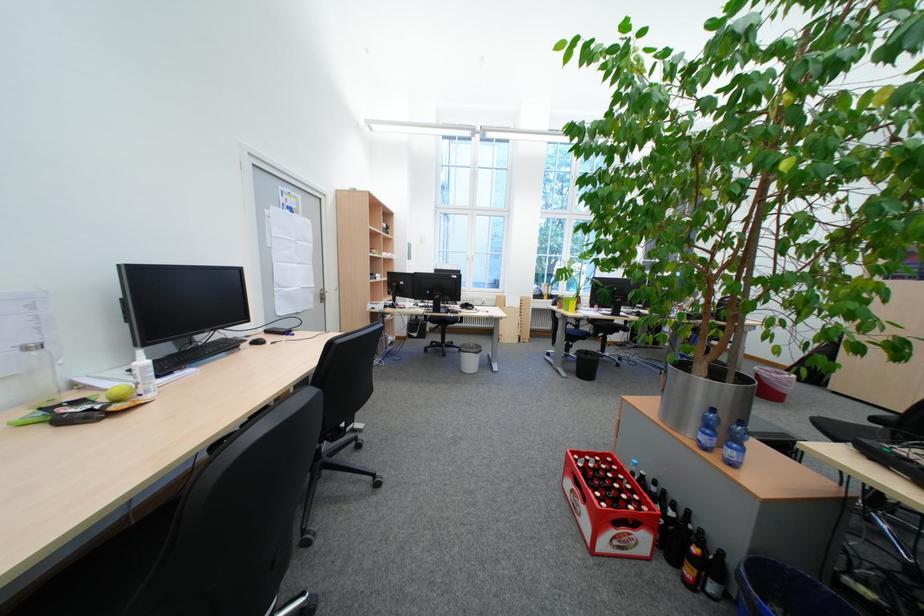
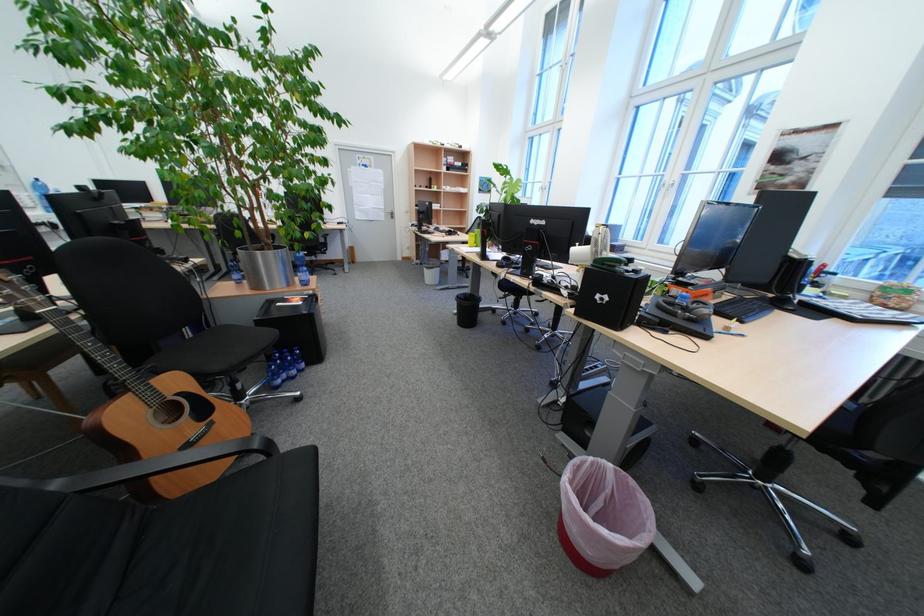
Find the pixel in the second image that matches [320,302] in the first image.

(394, 217)